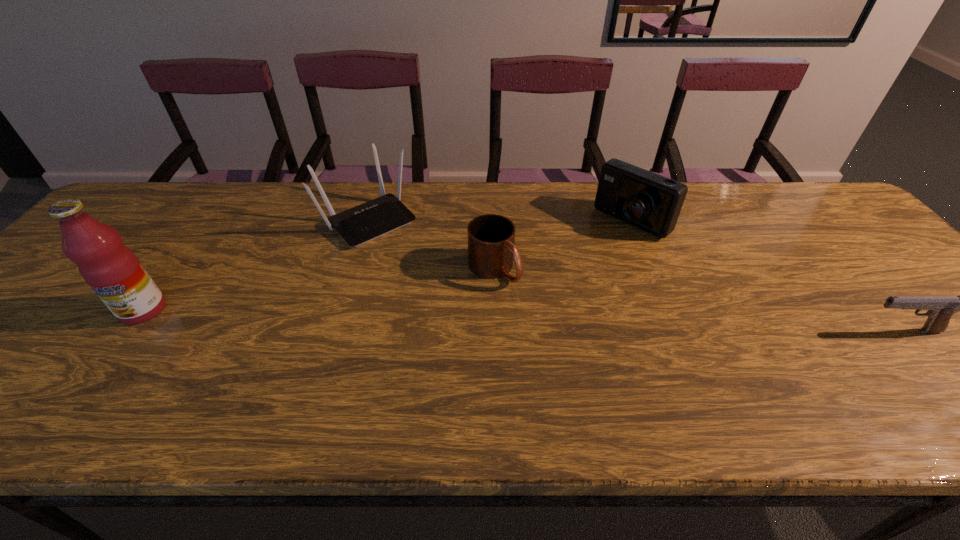
The image size is (960, 540). Identify the location of router at the far edge. (363, 223).

Locate an element on the screen. The image size is (960, 540). camera present at the far edge is located at coordinates (646, 200).

The height and width of the screenshot is (540, 960). In order to click on object that is positioned at the right edge in this screenshot , I will do coord(940,309).

The width and height of the screenshot is (960, 540). In order to click on vacant space at the far edge of the desktop in this screenshot , I will do `click(306, 193)`.

In the image, there is a desktop. Identify the location of vacant space at the near edge. This screenshot has width=960, height=540. (174, 353).

You are a GUI agent. You are given a task and a screenshot of the screen. Output one action in this format:
    pyautogui.click(x=<x>, y=<y>)
    Task: Click on the vacant space at the left edge of the desktop
    
    Given the screenshot: What is the action you would take?
    pyautogui.click(x=25, y=327)

The width and height of the screenshot is (960, 540). What are the coordinates of `vacant space at the far left corner of the desktop` in the screenshot? It's located at (160, 206).

In the image, there is a desktop. Where is `vacant space at the far right corner`? The image size is (960, 540). vacant space at the far right corner is located at coordinates (824, 203).

Where is `free space between the camera and the nearest object`? The height and width of the screenshot is (540, 960). free space between the camera and the nearest object is located at coordinates (766, 276).

Locate an element on the screen. The image size is (960, 540). free space that is in between the nearest object and the third object from left to right is located at coordinates (698, 300).